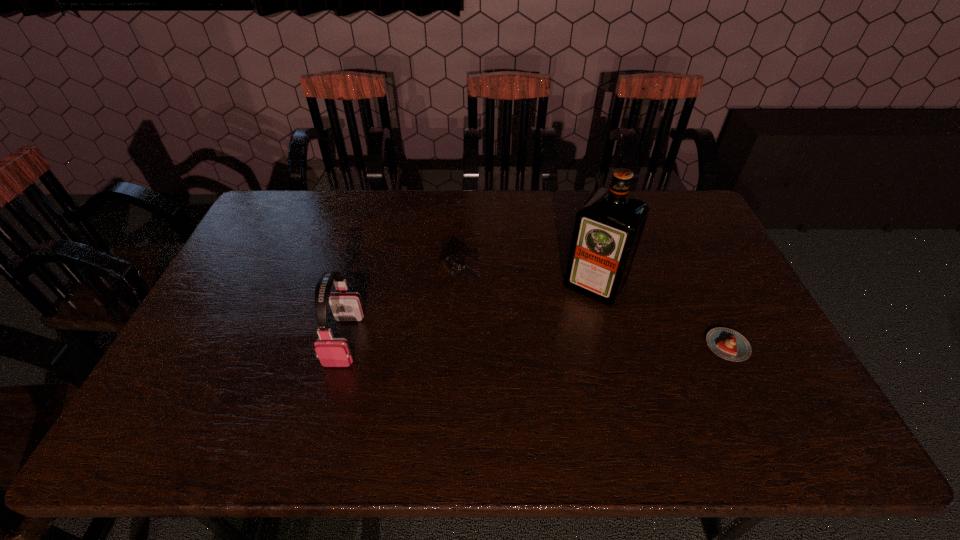
Locate an element on the screen. blank region between the tallest object and the pastry is located at coordinates (660, 316).

Identify which object is located as the third nearest to the pistol. Please provide its 2D coordinates. Your answer should be formatted as a tuple, i.e. [(x, y)], where the tuple contains the x and y coordinates of a point satisfying the conditions above.

[(728, 344)]

Find the location of a particular element. This screenshot has height=540, width=960. the second closest object to the pastry is located at coordinates (448, 265).

Image resolution: width=960 pixels, height=540 pixels. I want to click on vacant space that satisfies the following two spatial constraints: 1. on the front side of the liquor; 2. on the left side of the pastry, so click(x=610, y=346).

Where is `free spot that satisfies the following two spatial constraints: 1. on the front side of the shortest object; 2. on the left side of the tallest object`? The width and height of the screenshot is (960, 540). free spot that satisfies the following two spatial constraints: 1. on the front side of the shortest object; 2. on the left side of the tallest object is located at coordinates pos(610,346).

Find the location of a particular element. vacant space that satisfies the following two spatial constraints: 1. on the outer surface of the rightmost object; 2. on the right side of the leftmost object is located at coordinates (343, 346).

Locate an element on the screen. Image resolution: width=960 pixels, height=540 pixels. free location that satisfies the following two spatial constraints: 1. on the front side of the third object from right to left; 2. on the left side of the rightmost object is located at coordinates (456, 346).

Where is `free space that satisfies the following two spatial constraints: 1. on the front side of the pastry; 2. on the left side of the pistol`? This screenshot has width=960, height=540. free space that satisfies the following two spatial constraints: 1. on the front side of the pastry; 2. on the left side of the pistol is located at coordinates (456, 346).